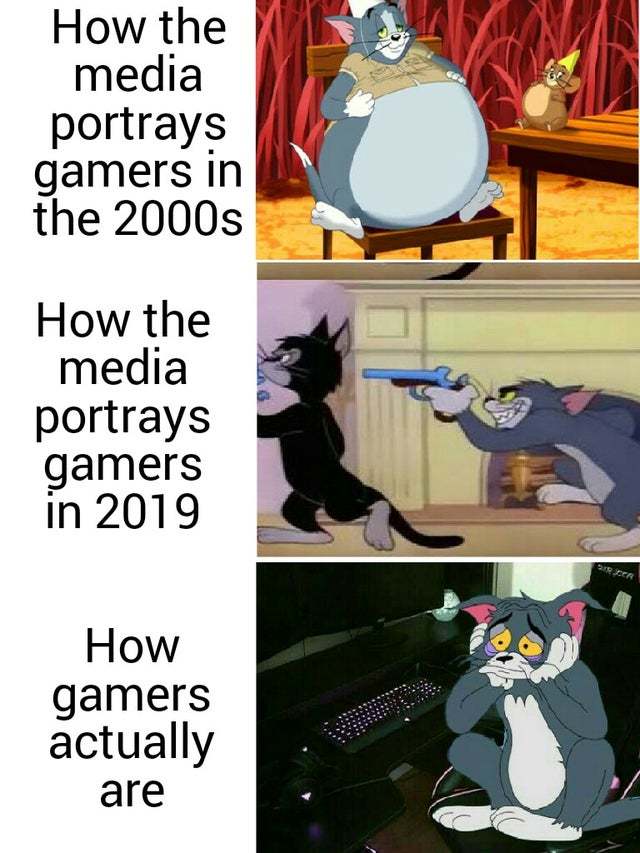
The height and width of the screenshot is (853, 640). I want to click on mouse, so click(528, 95).